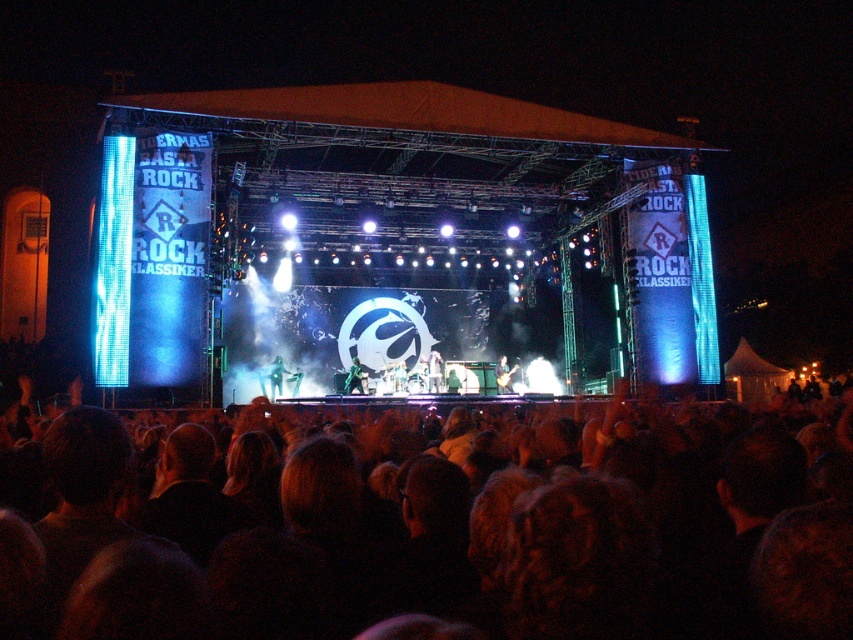
Who is positioned more to the right, black fabric crowd at lower center or metallic guitar at center?

black fabric crowd at lower center

Who is shorter, black fabric crowd at lower center or metallic guitar at center?

With less height is metallic guitar at center.

Does point (579, 500) come farther from viewer compared to point (402, 365)?

No.

The height and width of the screenshot is (640, 853). What are the coordinates of `black fabric crowd at lower center` in the screenshot? It's located at (474, 536).

Does shiny black guitar at center have a lesser height compared to green fabric figure at center stage?

In fact, shiny black guitar at center may be taller than green fabric figure at center stage.

Who is shorter, shiny black guitar at center or green fabric figure at center stage?

green fabric figure at center stage is shorter.

Does point (498, 385) come closer to viewer compared to point (358, 392)?

No, (498, 385) is further to viewer.

Image resolution: width=853 pixels, height=640 pixels. In order to click on shiny black guitar at center in this screenshot , I will do `click(503, 374)`.

This screenshot has width=853, height=640. What are the coordinates of `black fabric crowd at lower center` in the screenshot? It's located at (474, 536).

Does black fabric crowd at lower center appear on the right side of green metallic guitar at stage center?

Indeed, black fabric crowd at lower center is positioned on the right side of green metallic guitar at stage center.

Is point (610, 564) positioned in front of point (270, 374)?

Yes, it is.

The height and width of the screenshot is (640, 853). Identify the location of black fabric crowd at lower center. (474, 536).